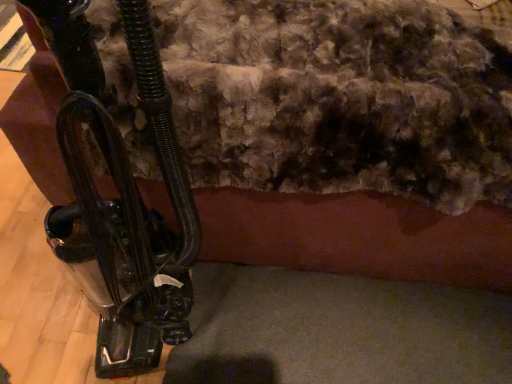
Describe the element at coordinates (340, 97) in the screenshot. I see `fuzzy wool at upper center` at that location.

What is the approximate height of fuzzy wool at upper center?

35.32 inches.

What is the approximate width of fuzzy wool at upper center?

fuzzy wool at upper center is 1.10 meters wide.

The width and height of the screenshot is (512, 384). What are the coordinates of `fuzzy wool at upper center` in the screenshot? It's located at (340, 97).

What do you see at coordinates (120, 198) in the screenshot? The image size is (512, 384). I see `metallic black vacuum cleaner at left` at bounding box center [120, 198].

At what (x,y) coordinates should I click in order to perform the action: click on metallic black vacuum cleaner at left. Please return your answer as a coordinate pair (x, y). The image size is (512, 384). Looking at the image, I should click on (120, 198).

Find the location of `fuzzy wool at upper center`. fuzzy wool at upper center is located at coordinates (340, 97).

From the picture: Does metallic black vacuum cleaner at left appear on the left side of fuzzy wool at upper center?

Yes, metallic black vacuum cleaner at left is to the left of fuzzy wool at upper center.

Considering the positions of objects metallic black vacuum cleaner at left and fuzzy wool at upper center in the image provided, who is in front, metallic black vacuum cleaner at left or fuzzy wool at upper center?

metallic black vacuum cleaner at left is in front.

Which is closer, (126, 25) or (259, 108)?

Point (126, 25) appears to be closer to the viewer than point (259, 108).

From the image's perspective, is metallic black vacuum cleaner at left located above or below fuzzy wool at upper center?

Based on their image positions, metallic black vacuum cleaner at left is located beneath fuzzy wool at upper center.

From a real-world perspective, is metallic black vacuum cleaner at left above or below fuzzy wool at upper center?

From a real-world perspective, metallic black vacuum cleaner at left is physically above fuzzy wool at upper center.

Can you confirm if metallic black vacuum cleaner at left is wider than fuzzy wool at upper center?

Incorrect, the width of metallic black vacuum cleaner at left does not surpass that of fuzzy wool at upper center.

Considering the relative sizes of metallic black vacuum cleaner at left and fuzzy wool at upper center in the image provided, is metallic black vacuum cleaner at left taller than fuzzy wool at upper center?

Yes.

Who is smaller, metallic black vacuum cleaner at left or fuzzy wool at upper center?

With smaller size is metallic black vacuum cleaner at left.

Can we say metallic black vacuum cleaner at left lies outside fuzzy wool at upper center?

Yes, metallic black vacuum cleaner at left is not within fuzzy wool at upper center.

Is metallic black vacuum cleaner at left next to fuzzy wool at upper center?

No, metallic black vacuum cleaner at left is not in contact with fuzzy wool at upper center.

Is metallic black vacuum cleaner at left facing towards fuzzy wool at upper center?

No, metallic black vacuum cleaner at left is not facing towards fuzzy wool at upper center.

Can you tell me how much metallic black vacuum cleaner at left and fuzzy wool at upper center differ in facing direction?

metallic black vacuum cleaner at left and fuzzy wool at upper center are facing 103 degrees away from each other.

At what (x,y) coordinates should I click in order to perform the action: click on vehicle above the fuzzy wool at upper center (from a real-world perspective). Please return your answer as a coordinate pair (x, y). This screenshot has height=384, width=512. Looking at the image, I should click on (120, 198).

Considering the relative positions of fuzzy wool at upper center and metallic black vacuum cleaner at left in the image provided, is fuzzy wool at upper center to the left or to the right of metallic black vacuum cleaner at left?

Clearly, fuzzy wool at upper center is on the right of metallic black vacuum cleaner at left in the image.

Which object is further away from the camera, fuzzy wool at upper center or metallic black vacuum cleaner at left?

fuzzy wool at upper center is behind.

Between point (504, 87) and point (75, 165), which one is positioned in front?

The point (75, 165) is in front.

From the image's perspective, between fuzzy wool at upper center and metallic black vacuum cleaner at left, who is located below?

metallic black vacuum cleaner at left, from the image's perspective.

From a real-world perspective, which object stands above the other?

metallic black vacuum cleaner at left.

Looking at their sizes, would you say fuzzy wool at upper center is wider or thinner than metallic black vacuum cleaner at left?

fuzzy wool at upper center is wider than metallic black vacuum cleaner at left.

In terms of height, does fuzzy wool at upper center look taller or shorter compared to metallic black vacuum cleaner at left?

In the image, fuzzy wool at upper center appears to be shorter than metallic black vacuum cleaner at left.

Does fuzzy wool at upper center have a smaller size compared to metallic black vacuum cleaner at left?

Actually, fuzzy wool at upper center might be larger than metallic black vacuum cleaner at left.

Is fuzzy wool at upper center situated inside metallic black vacuum cleaner at left or outside?

fuzzy wool at upper center is outside metallic black vacuum cleaner at left.

Are fuzzy wool at upper center and metallic black vacuum cleaner at left making contact?

fuzzy wool at upper center is not next to metallic black vacuum cleaner at left, and they're not touching.

Is fuzzy wool at upper center oriented away from metallic black vacuum cleaner at left?

Correct, fuzzy wool at upper center is looking away from metallic black vacuum cleaner at left.

Based on the photo, how different are the orientations of fuzzy wool at upper center and metallic black vacuum cleaner at left in degrees?

They differ by 103 degrees in their facing directions.

I want to click on vehicle lying in front of the fuzzy wool at upper center, so click(120, 198).

The image size is (512, 384). Find the location of `vehicle above the fuzzy wool at upper center (from a real-world perspective)`. vehicle above the fuzzy wool at upper center (from a real-world perspective) is located at coordinates (120, 198).

You are a GUI agent. You are given a task and a screenshot of the screen. Output one action in this format:
    pyautogui.click(x=<x>, y=<y>)
    Task: Click on the vehicle lying below the fuzzy wool at upper center (from the image's perspective)
    Image resolution: width=512 pixels, height=384 pixels.
    Given the screenshot: What is the action you would take?
    pyautogui.click(x=120, y=198)